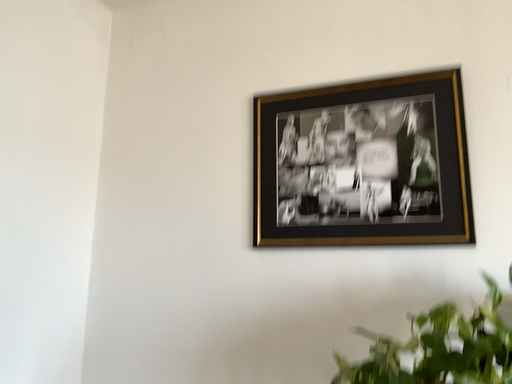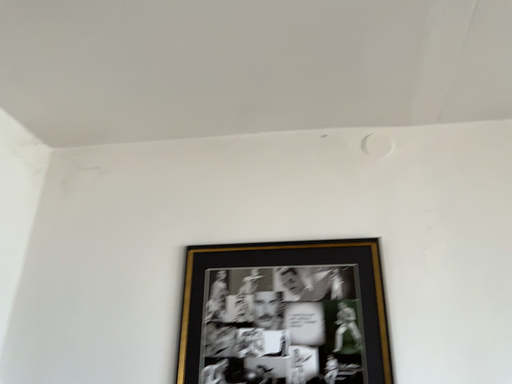
Question: How did the camera likely rotate when shooting the video?

Choices:
 (A) rotated downward
 (B) rotated upward

Answer: (B)